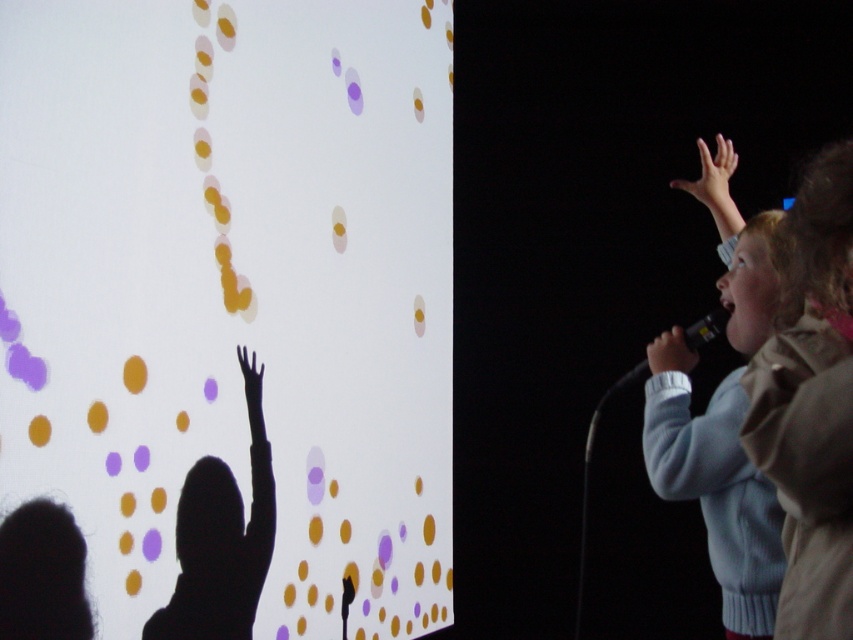
You are a photographer at the event and want to capture a photo that includes both the light brown jacket at right and the black matte hand at upper left. Which object should you focus on first to ensure both are in frame?

You should focus on the light brown jacket at right first because it is taller than the black matte hand at upper left, so it will require more space in the frame.